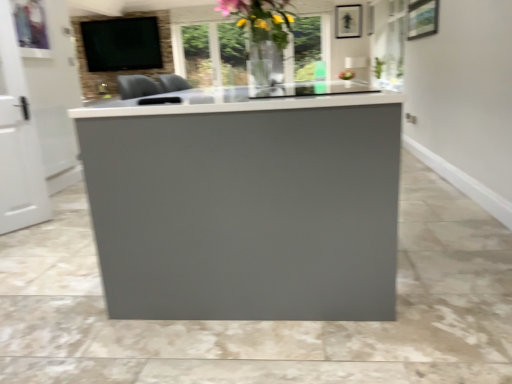
This screenshot has height=384, width=512. Identify the location of free spot to the right of white glossy door at left. (54, 228).